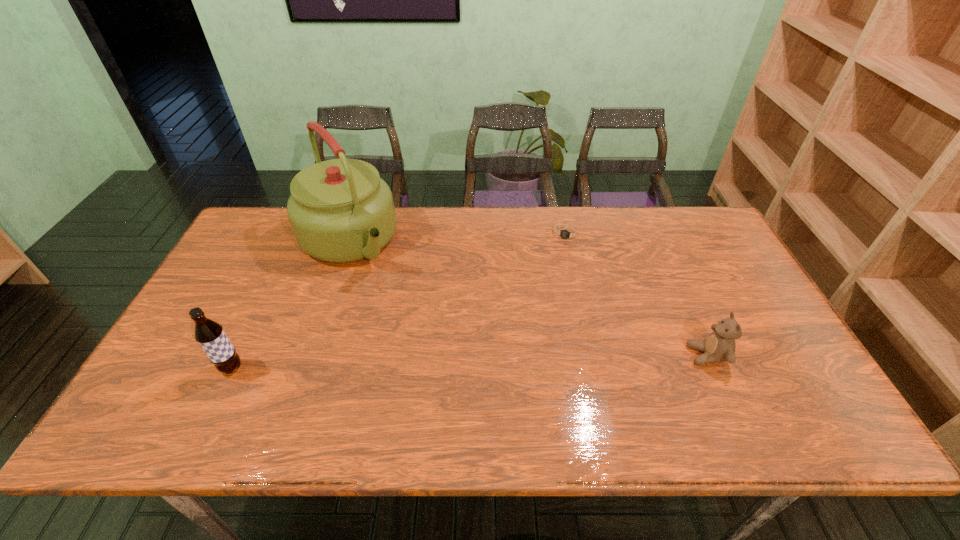
Locate an element on the screen. vacant region between the second tallest object and the shortest object is located at coordinates (399, 301).

Where is `vacant point located between the shortest object and the tallest object`? vacant point located between the shortest object and the tallest object is located at coordinates (457, 238).

You are a GUI agent. You are given a task and a screenshot of the screen. Output one action in this format:
    pyautogui.click(x=<x>, y=<y>)
    Task: Click on the empty location between the tallest object and the rightmost object
    
    Given the screenshot: What is the action you would take?
    pyautogui.click(x=527, y=298)

You are a GUI agent. You are given a task and a screenshot of the screen. Output one action in this format:
    pyautogui.click(x=<x>, y=<y>)
    Task: Click on the free space between the kettle and the root beer
    
    Given the screenshot: What is the action you would take?
    click(290, 305)

This screenshot has width=960, height=540. I want to click on free spot between the root beer and the rightmost object, so click(469, 362).

Find the location of `vacant area that lies between the watch and the kettle`. vacant area that lies between the watch and the kettle is located at coordinates (457, 238).

The height and width of the screenshot is (540, 960). In order to click on vacant area between the third shortest object and the kettle in this screenshot , I will do `click(290, 305)`.

You are a GUI agent. You are given a task and a screenshot of the screen. Output one action in this format:
    pyautogui.click(x=<x>, y=<y>)
    Task: Click on the object that is the closest to the root beer
    
    Given the screenshot: What is the action you would take?
    pyautogui.click(x=340, y=210)

I want to click on the third closest object to the shortest object, so click(210, 335).

Where is `free location that satisfies the following two spatial constraints: 1. on the back side of the root beer; 2. on the front-facing side of the second shortest object`? The height and width of the screenshot is (540, 960). free location that satisfies the following two spatial constraints: 1. on the back side of the root beer; 2. on the front-facing side of the second shortest object is located at coordinates (238, 355).